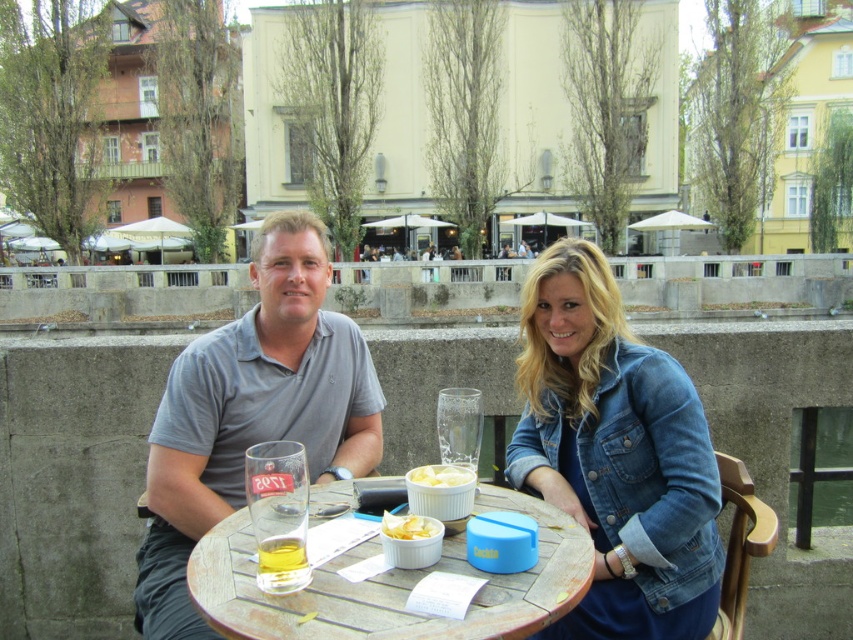
Between point (349, 621) and point (268, 547), which one is positioned behind?

The point (268, 547) is behind.

Is point (444, 566) farther from camera compared to point (299, 588)?

Yes, it is.

At what (x,y) coordinates should I click in order to perform the action: click on wooden table at center. Please return your answer as a coordinate pair (x, y). Looking at the image, I should click on click(390, 586).

Image resolution: width=853 pixels, height=640 pixels. I want to click on wooden table at center, so click(390, 586).

Does denim jacket at lower right come behind wooden table at center?

Yes, it is behind wooden table at center.

Does denim jacket at lower right have a greater width compared to wooden table at center?

Incorrect, denim jacket at lower right's width does not surpass wooden table at center's.

Find the location of a particular element. The image size is (853, 640). denim jacket at lower right is located at coordinates (614, 454).

Between gray cotton shirt at left and translucent glass cup at table center, which one has more height?

With more height is gray cotton shirt at left.

Is gray cotton shirt at left positioned in front of translucent glass cup at table center?

No, it is not.

Who is more distant from viewer, (320, 481) or (296, 572)?

Positioned behind is point (320, 481).

Identify the location of gray cotton shirt at left. (618, 451).